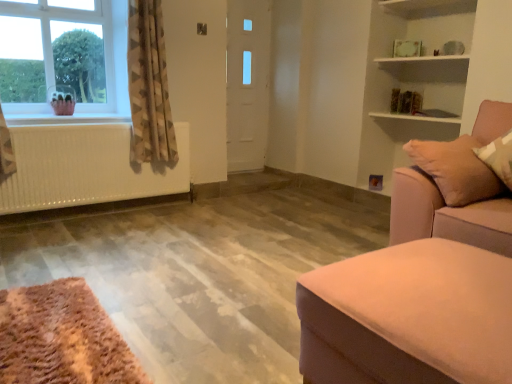
Question: From the image's perspective, is white glossy door at center beneath suede-like beige studio couch at right, which is the 1th studio couch from back to front?

Choices:
 (A) no
 (B) yes

Answer: (A)

Question: Can we say white glossy door at center lies outside suede-like beige studio couch at right, which is the 1th studio couch from back to front?

Choices:
 (A) yes
 (B) no

Answer: (A)

Question: From a real-world perspective, is white glossy door at center on suede-like beige studio couch at right, the 2th studio couch positioned from the front?

Choices:
 (A) no
 (B) yes

Answer: (B)

Question: Does white glossy door at center have a larger size compared to suede-like beige studio couch at right, the 2th studio couch positioned from the front?

Choices:
 (A) yes
 (B) no

Answer: (B)

Question: Can you confirm if white glossy door at center is shorter than suede-like beige studio couch at right, which is the 1th studio couch from back to front?

Choices:
 (A) no
 (B) yes

Answer: (A)

Question: Does white glossy door at center lie behind suede-like beige studio couch at right, which is the 1th studio couch from back to front?

Choices:
 (A) no
 (B) yes

Answer: (B)

Question: Is beige textured curtain at left to the right of suede-like beige studio couch at right, which is the 1th studio couch from back to front, from the viewer's perspective?

Choices:
 (A) yes
 (B) no

Answer: (B)

Question: Would you say suede-like beige studio couch at right, which is the 1th studio couch from back to front, is part of beige textured curtain at left's contents?

Choices:
 (A) no
 (B) yes

Answer: (A)

Question: From a real-world perspective, is beige textured curtain at left positioned under suede-like beige studio couch at right, which is the 1th studio couch from back to front, based on gravity?

Choices:
 (A) yes
 (B) no

Answer: (B)

Question: Is beige textured curtain at left touching suede-like beige studio couch at right, the 2th studio couch positioned from the front?

Choices:
 (A) yes
 (B) no

Answer: (B)

Question: Does beige textured curtain at left have a lesser height compared to suede-like beige studio couch at right, the 2th studio couch positioned from the front?

Choices:
 (A) no
 (B) yes

Answer: (A)

Question: Can you confirm if beige textured curtain at left is thinner than suede-like beige studio couch at right, the 2th studio couch positioned from the front?

Choices:
 (A) yes
 (B) no

Answer: (A)

Question: Is suede-like beige studio couch at right, the 2th studio couch positioned from the front, located outside white matte radiator at left?

Choices:
 (A) yes
 (B) no

Answer: (A)